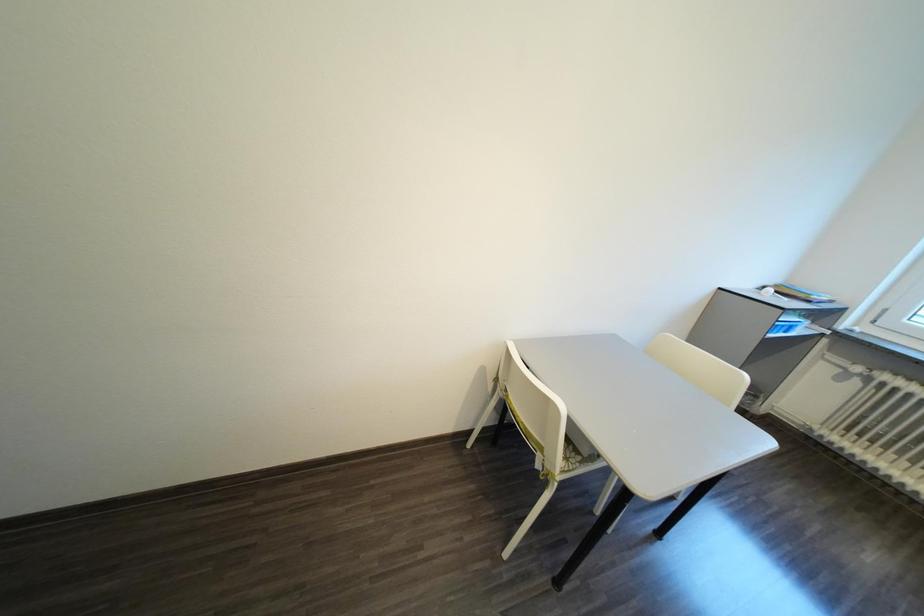
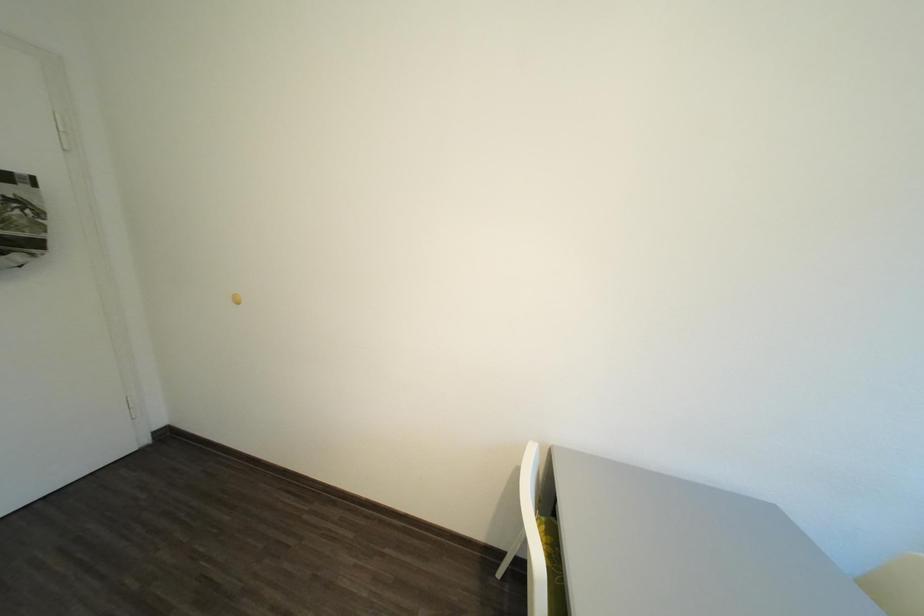
Question: Based on the continuous images, in which direction is the camera rotating? Reply with the corresponding letter.

Choices:
 (A) Left
 (B) Right
 (C) Up
 (D) Down

Answer: (A)